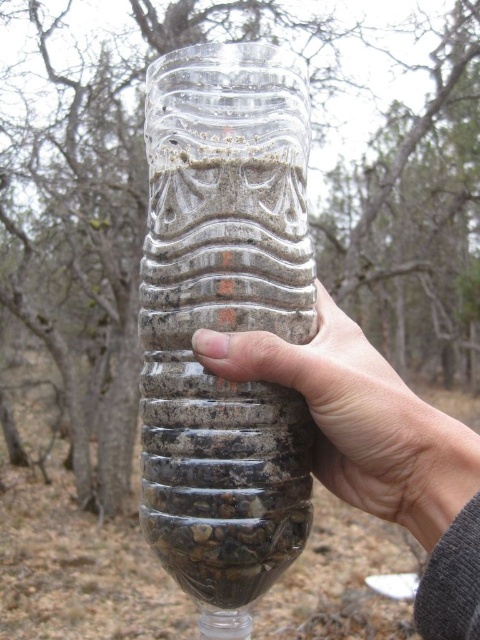
Does clear textured glass jar at center lie behind clear plastic bottle at center?

Yes.

Between clear textured glass jar at center and clear plastic bottle at center, which one is positioned higher?

clear textured glass jar at center is above.

Where is `clear textured glass jar at center`? This screenshot has width=480, height=640. clear textured glass jar at center is located at coordinates (225, 321).

Image resolution: width=480 pixels, height=640 pixels. I want to click on clear textured glass jar at center, so click(225, 321).